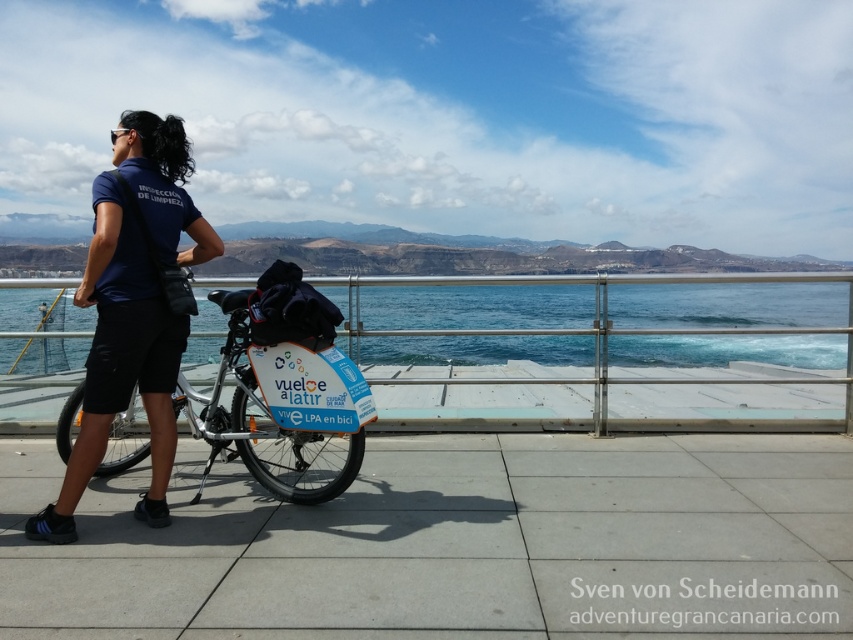
Question: Which object is farther from the camera taking this photo?

Choices:
 (A) blue water at lower center
 (B) blue matte bicycle at center

Answer: (A)

Question: Does blue fabric shirt at center appear on the right side of blue matte bicycle at center?

Choices:
 (A) no
 (B) yes

Answer: (A)

Question: Which of the following is the closest to the observer?

Choices:
 (A) (186, 214)
 (B) (682, 336)
 (C) (268, 472)

Answer: (A)

Question: Is blue water at lower center closer to the viewer compared to blue fabric shirt at center?

Choices:
 (A) yes
 (B) no

Answer: (B)

Question: Among these points, which one is farthest from the camera?

Choices:
 (A) (144, 442)
 (B) (125, 252)
 (C) (386, 321)

Answer: (C)

Question: Does blue water at lower center appear on the left side of blue matte bicycle at center?

Choices:
 (A) yes
 (B) no

Answer: (B)